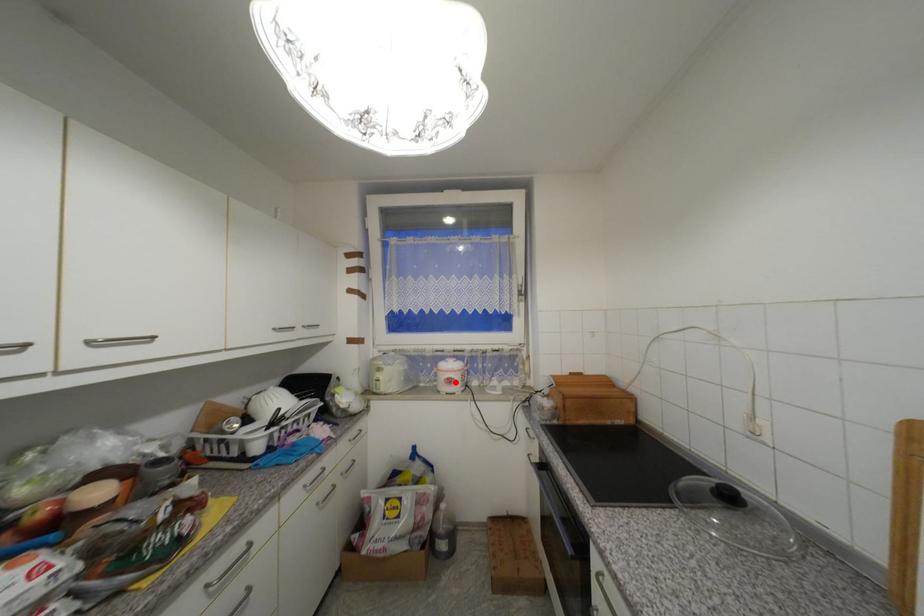
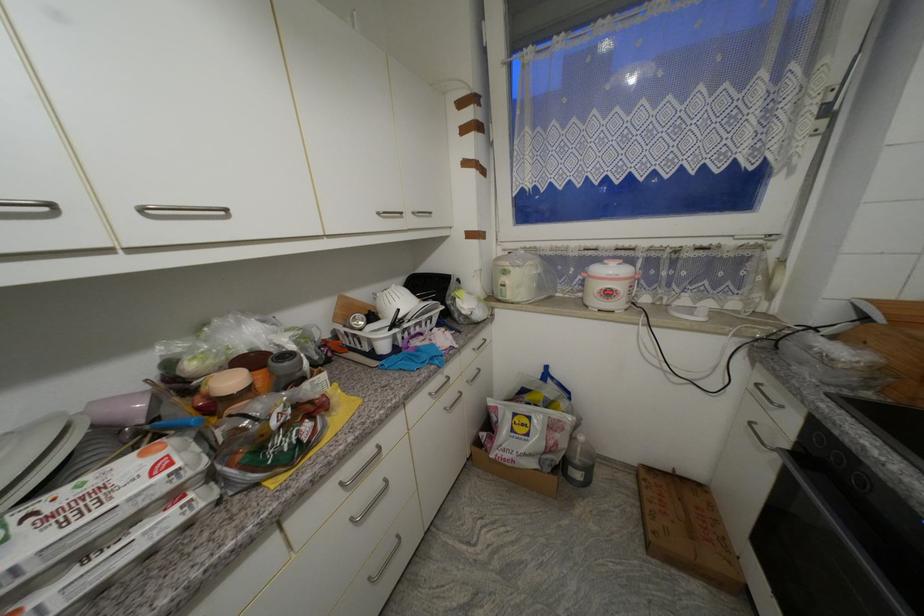
Question: I am providing you with two images of the same scene from different viewpoints. A red point is shown in image1. For the corresponding object point in image2, is it positioned nearer or farther from the camera?

Choices:
 (A) Nearer
 (B) Farther

Answer: (A)